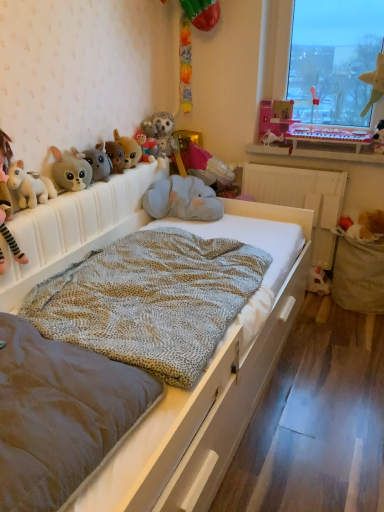
The height and width of the screenshot is (512, 384). In order to click on free space above white wood bed frame at center (from a real-world perspective) in this screenshot , I will do `click(283, 165)`.